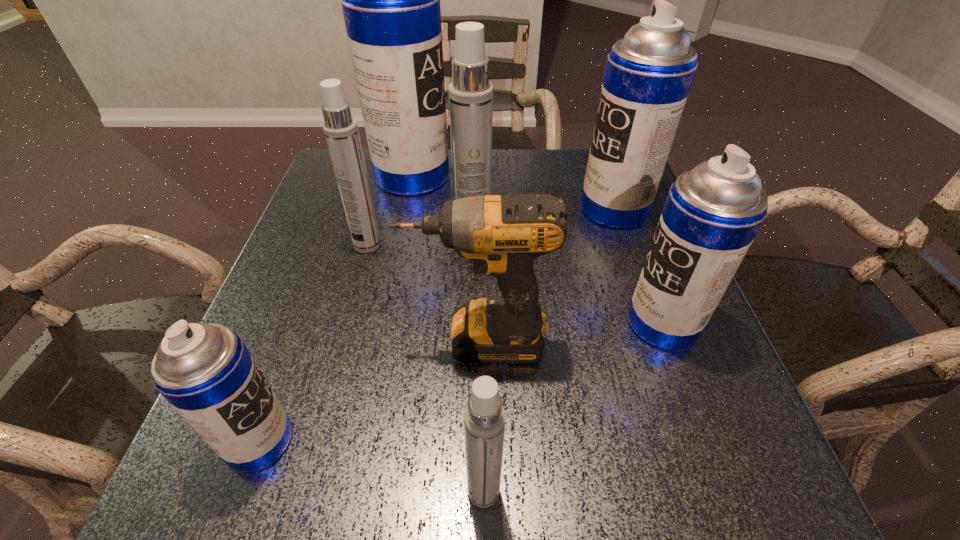
The image size is (960, 540). I want to click on free location located on the label side of the second nearest blue aerosol can, so click(x=521, y=323).

Find the location of a particular element. The image size is (960, 540). vacant space located 0.050m with the drill bit of the drill facing forward is located at coordinates (381, 340).

Locate an element on the screen. Image resolution: width=960 pixels, height=540 pixels. vacant space located with the drill bit of the drill facing forward is located at coordinates (x=326, y=340).

I want to click on vacant area situated 0.190m with the drill bit of the drill facing forward, so click(304, 340).

This screenshot has height=540, width=960. Identify the location of vacant space located 0.370m on the label side of the sixth farthest aerosol can. (536, 440).

Image resolution: width=960 pixels, height=540 pixels. I want to click on free spot located 0.160m on the left of the nearest white aerosol can, so click(353, 491).

What are the coordinates of `object at the far left corner` in the screenshot? It's located at (390, 0).

In order to click on object positioned at the near left corner in this screenshot , I will do `click(205, 371)`.

What are the coordinates of `object positioned at the far right corner` in the screenshot? It's located at (648, 75).

Where is `vacant region at the far edge of the desktop`? vacant region at the far edge of the desktop is located at coordinates (559, 166).